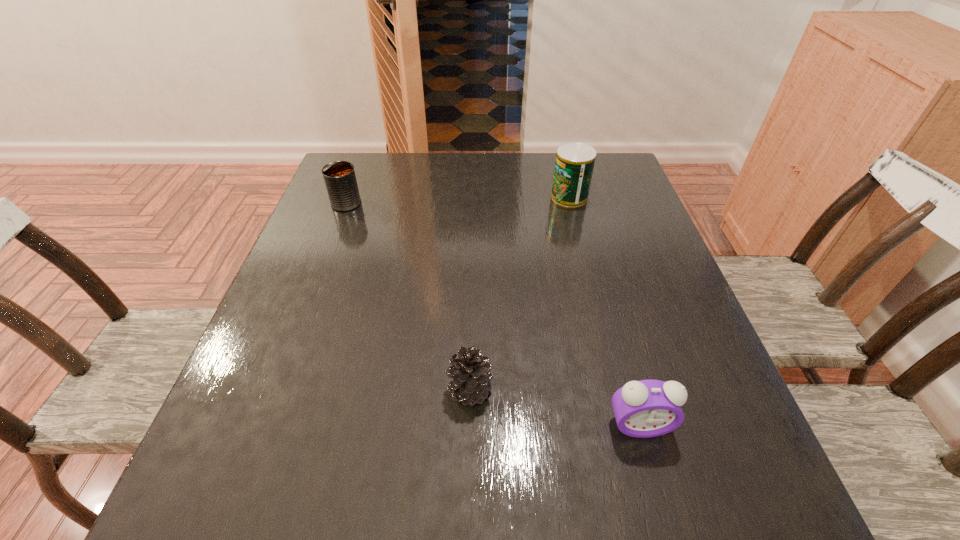
Locate an element on the screen. The image size is (960, 540). free space between the right can and the alarm clock is located at coordinates (604, 311).

The height and width of the screenshot is (540, 960). I want to click on unoccupied position between the nearest object and the leftmost object, so click(492, 314).

Find the location of a particular element. vacant region between the nearest object and the right can is located at coordinates (604, 311).

The width and height of the screenshot is (960, 540). I want to click on vacant point located between the third farthest object and the left can, so click(408, 296).

I want to click on empty space between the second object from left to right and the right can, so click(519, 293).

Where is `empty location between the second nearest object and the alarm clock`? The height and width of the screenshot is (540, 960). empty location between the second nearest object and the alarm clock is located at coordinates (554, 408).

I want to click on unoccupied position between the alarm clock and the second object from left to right, so click(554, 408).

Find the location of a particular element. free spot between the third object from right to left and the nearest object is located at coordinates [554, 408].

Where is `vacant point located between the pinecone and the nearest object`? The height and width of the screenshot is (540, 960). vacant point located between the pinecone and the nearest object is located at coordinates (554, 408).

Find the location of a particular element. The width and height of the screenshot is (960, 540). the closest object to the pinecone is located at coordinates (648, 408).